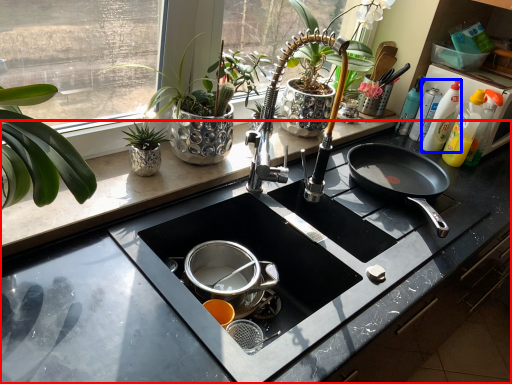
Question: Which object appears closest to the camera in this image, countertop (highlighted by a red box) or cleaning product (highlighted by a blue box)?

Choices:
 (A) countertop
 (B) cleaning product

Answer: (A)